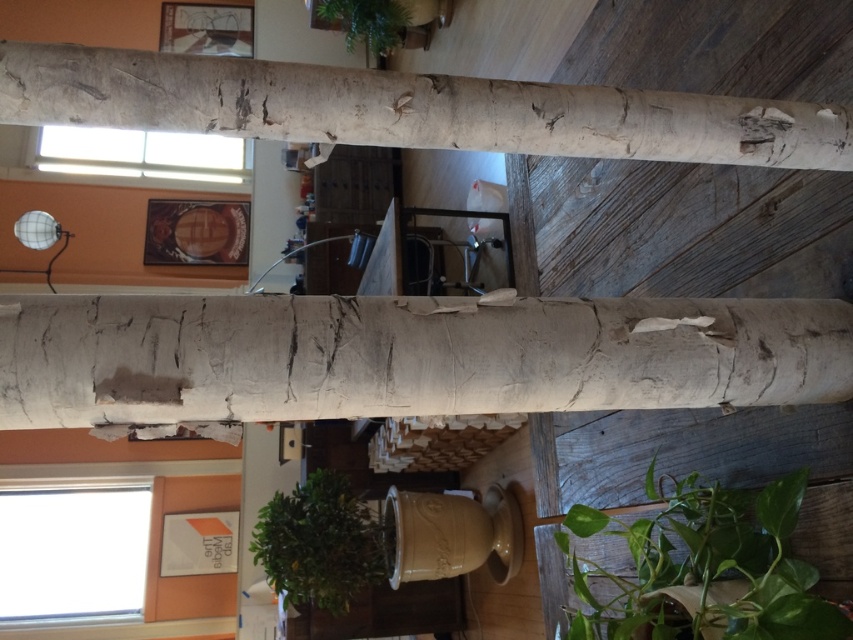
Question: Which is nearer to the green matte plant at center?

Choices:
 (A) green matte plant at lower right
 (B) green leafy plant at upper center
 (C) white rough bark at center
 (D) white rough wood beam at upper center

Answer: (A)

Question: Which point appears farthest from the camera in this image?

Choices:
 (A) tap(726, 621)
 (B) tap(350, 44)
 (C) tap(321, 573)

Answer: (B)

Question: From the image, what is the correct spatial relationship of white rough wood beam at upper center in relation to green matte plant at center?

Choices:
 (A) below
 (B) above

Answer: (B)

Question: Can you confirm if green matte plant at lower right is positioned above green leafy plant at upper center?

Choices:
 (A) no
 (B) yes

Answer: (A)

Question: Is white rough bark at center thinner than white rough wood beam at upper center?

Choices:
 (A) yes
 (B) no

Answer: (A)

Question: Among these objects, which one is farthest from the camera?

Choices:
 (A) green matte plant at center
 (B) green leafy plant at upper center
 (C) green matte plant at lower right
 (D) white rough wood beam at upper center

Answer: (B)